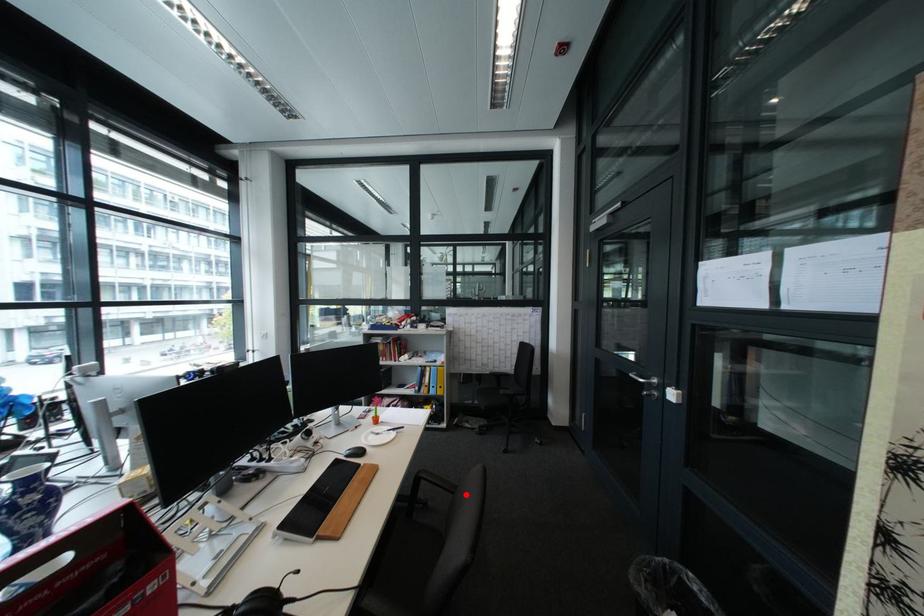
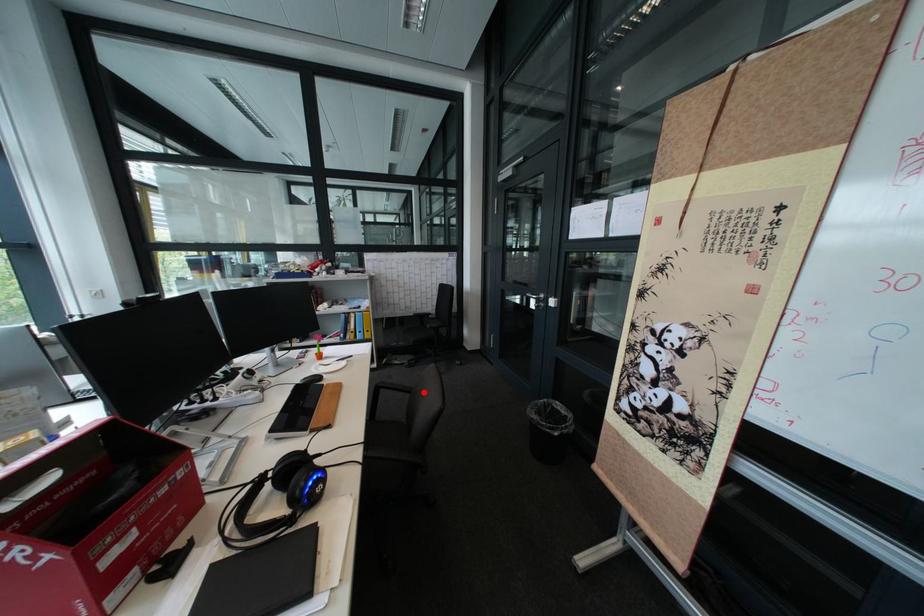
I am providing you with two images of the same scene from different viewpoints. A red point is marked on the first image and another point is marked on the second image. Is the red point in image1 aligned with the point shown in image2?

Yes